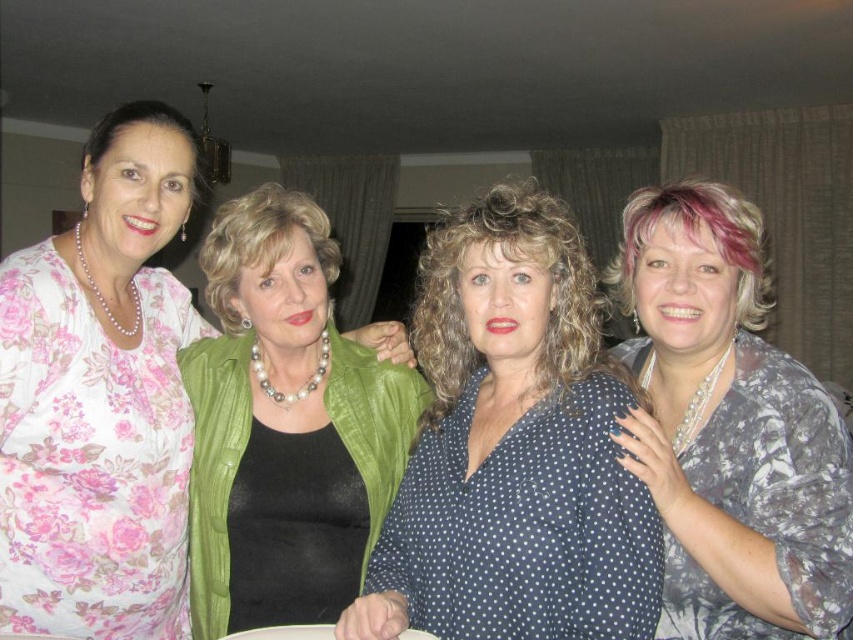
Does point (460, 480) come closer to viewer compared to point (372, 358)?

Yes, point (460, 480) is in front of point (372, 358).

Does polka dot blouse at center have a lesser height compared to pearl necklace at center?

Correct, polka dot blouse at center is not as tall as pearl necklace at center.

Between point (572, 248) and point (350, 468), which one is positioned behind?

The point (350, 468) is more distant.

Identify the location of polka dot blouse at center. (514, 449).

Can you confirm if floral fabric blouse at left is shorter than pearl necklace at center?

In fact, floral fabric blouse at left may be taller than pearl necklace at center.

Can you confirm if floral fabric blouse at left is positioned below pearl necklace at center?

Actually, floral fabric blouse at left is above pearl necklace at center.

Who is more distant from viewer, (165, 316) or (212, 292)?

The point (165, 316) is behind.

Identify the location of floral fabric blouse at left. This screenshot has width=853, height=640. (100, 397).

Can you confirm if floral fabric blouse at left is positioned to the right of printed silk blouse at right?

Incorrect, floral fabric blouse at left is not on the right side of printed silk blouse at right.

Which is more to the right, floral fabric blouse at left or printed silk blouse at right?

printed silk blouse at right is more to the right.

The height and width of the screenshot is (640, 853). What do you see at coordinates (100, 397) in the screenshot?
I see `floral fabric blouse at left` at bounding box center [100, 397].

This screenshot has width=853, height=640. I want to click on floral fabric blouse at left, so click(100, 397).